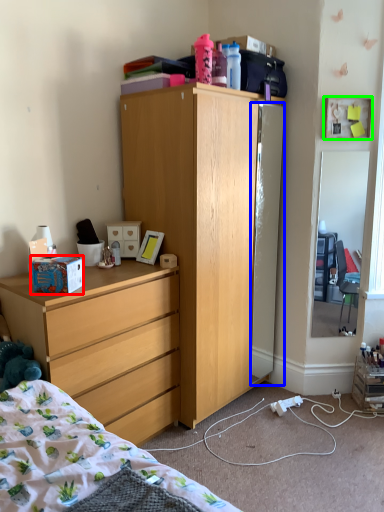
Question: Which object is the closest to the box (highlighted by a red box)? Choose among these: refrigerator (highlighted by a blue box) or picture frame (highlighted by a green box).

Choices:
 (A) refrigerator
 (B) picture frame

Answer: (A)